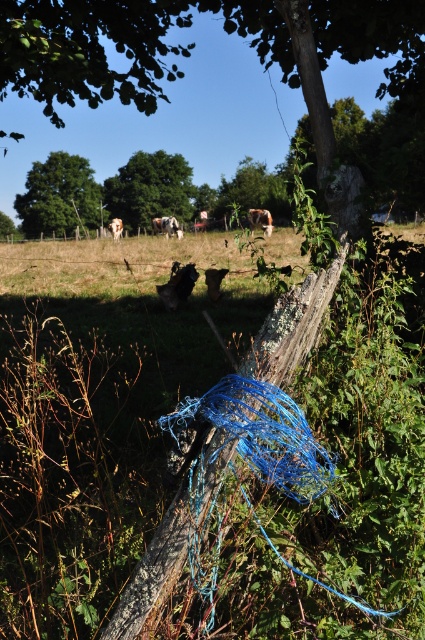
Question: Estimate the real-world distances between objects in this image. Which object is farther from the brown wood tree at center?

Choices:
 (A) green rough bark tree at center
 (B) brown fur at center
 (C) brown furry cow at center

Answer: (A)

Question: Can you confirm if brown wood tree at center is positioned to the left of white woolen sheep at center?

Choices:
 (A) no
 (B) yes

Answer: (B)

Question: Does green rough bark tree at center appear on the right side of brown furry cow at center?

Choices:
 (A) yes
 (B) no

Answer: (A)

Question: Which point is closer to the camera?

Choices:
 (A) brown wood tree at center
 (B) brown furry cow at center
 (C) white woolen sheep at center
 (D) green rough bark tree at center

Answer: (A)

Question: Which object appears closest to the camera in this image?

Choices:
 (A) green rough bark tree at center
 (B) brown fur at center
 (C) green leafy tree at upper left

Answer: (B)

Question: Is green leafy tree at upper left to the right of brown furry cow at center from the viewer's perspective?

Choices:
 (A) yes
 (B) no

Answer: (B)